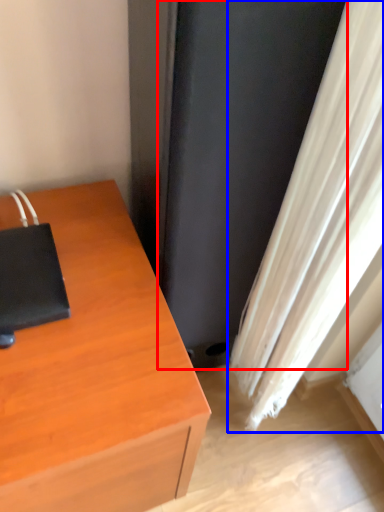
Question: Among these objects, which one is nearest to the camera, screen door (highlighted by a red box) or curtain (highlighted by a blue box)?

Choices:
 (A) screen door
 (B) curtain

Answer: (B)